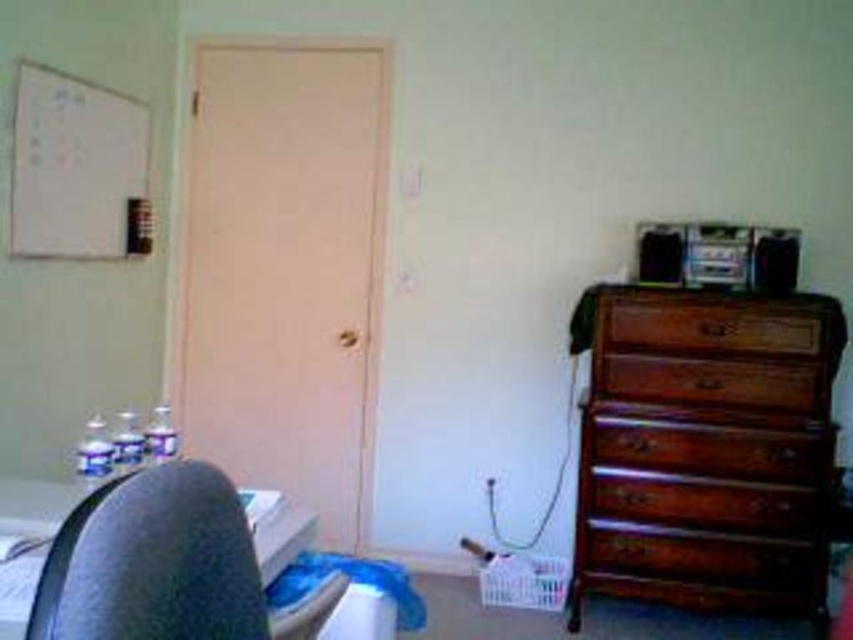
You are trying to place a large rectangular box on the wooden dresser at right and the wooden drawer at right. Which surface can accommodate the box in terms of width?

The wooden dresser at right is wider than the wooden drawer at right, so the box should fit better on the dresser.

You are organizing a small party and need to place a 1.5 meter long banner on the wooden dresser at right or the brown wood drawer at right. Which surface can accommodate the banner without overhanging?

The wooden dresser at right is larger in size than the brown wood drawer at right, so the banner can be placed on the wooden dresser at right without overhanging.